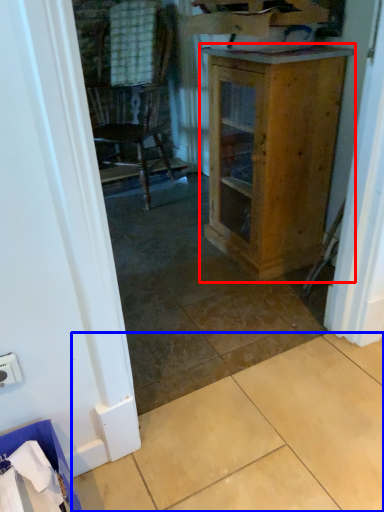
Question: Which point is further to the camera, cabinetry (highlighted by a red box) or tile (highlighted by a blue box)?

Choices:
 (A) cabinetry
 (B) tile

Answer: (A)